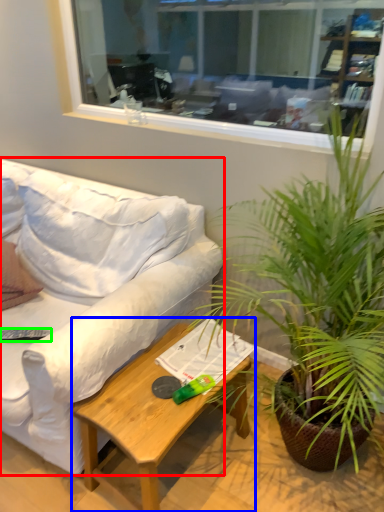
Question: Which object is positioned farthest from studio couch (highlighted by a red box)? Select from coffee table (highlighted by a blue box) and remote control (highlighted by a green box).

Choices:
 (A) coffee table
 (B) remote control

Answer: (B)